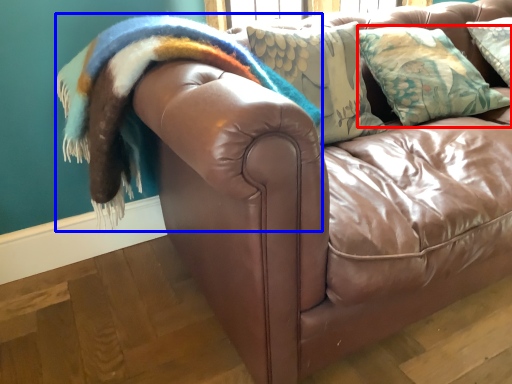
Question: Which object is closer to the camera taking this photo, pillow (highlighted by a red box) or blanket (highlighted by a blue box)?

Choices:
 (A) pillow
 (B) blanket

Answer: (B)